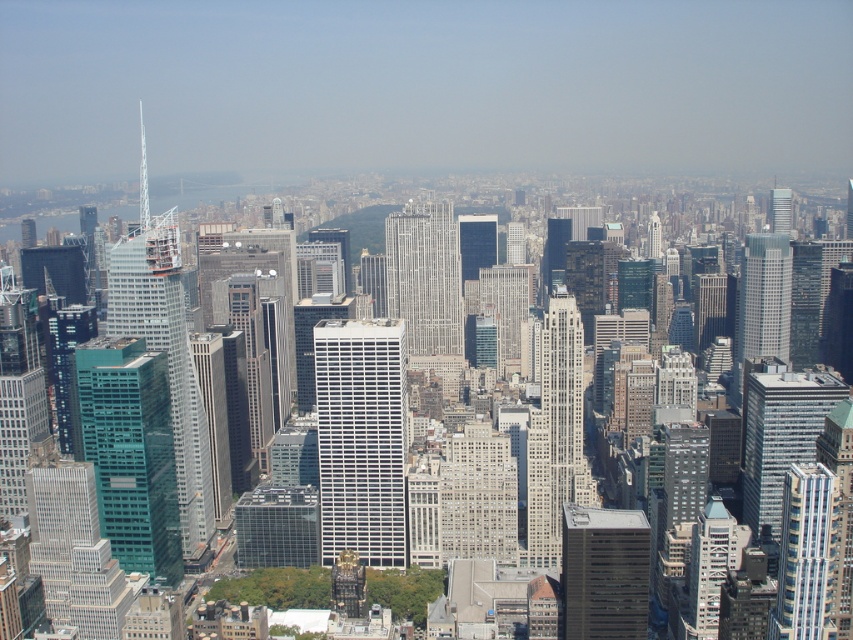
What do you see at coordinates (131, 451) in the screenshot?
I see `green glass building at left` at bounding box center [131, 451].

Between point (115, 540) and point (811, 579), which one is positioned behind?

Positioned behind is point (811, 579).

Where is `green glass building at left`? green glass building at left is located at coordinates (131, 451).

Based on the photo, does white glass building at right have a smaller size compared to blue glass skyscraper at center-right?

Actually, white glass building at right might be larger than blue glass skyscraper at center-right.

Which is behind, point (756, 509) or point (813, 497)?

The point (813, 497) is more distant.

Locate an element on the screen. This screenshot has width=853, height=640. white glass building at right is located at coordinates (780, 436).

Can you confirm if white glass building at center is wider than white glass skyscraper at center?

Yes, white glass building at center is wider than white glass skyscraper at center.

Find the location of a particular element. Image resolution: width=853 pixels, height=640 pixels. white glass building at center is located at coordinates (361, 440).

Identify the location of white glass building at center. (361, 440).